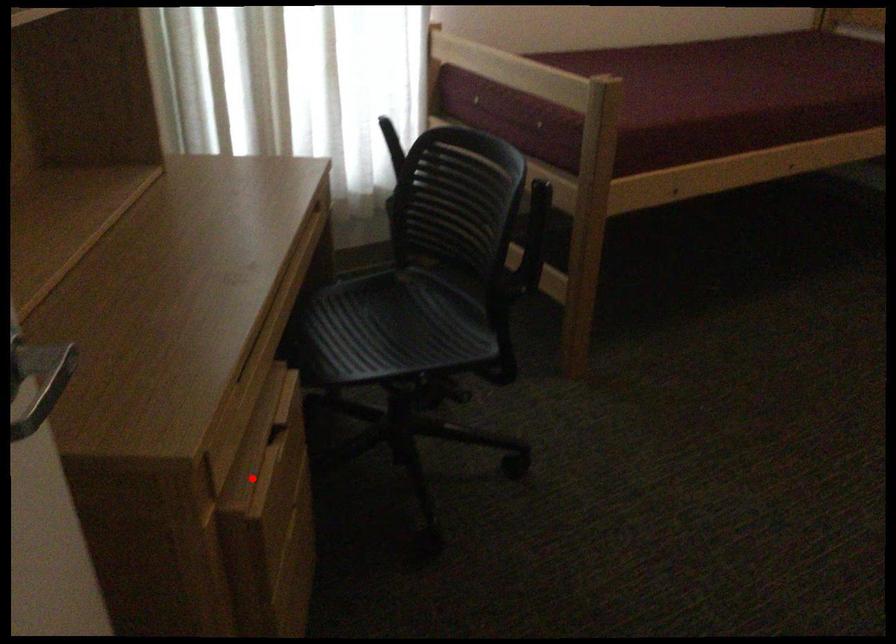
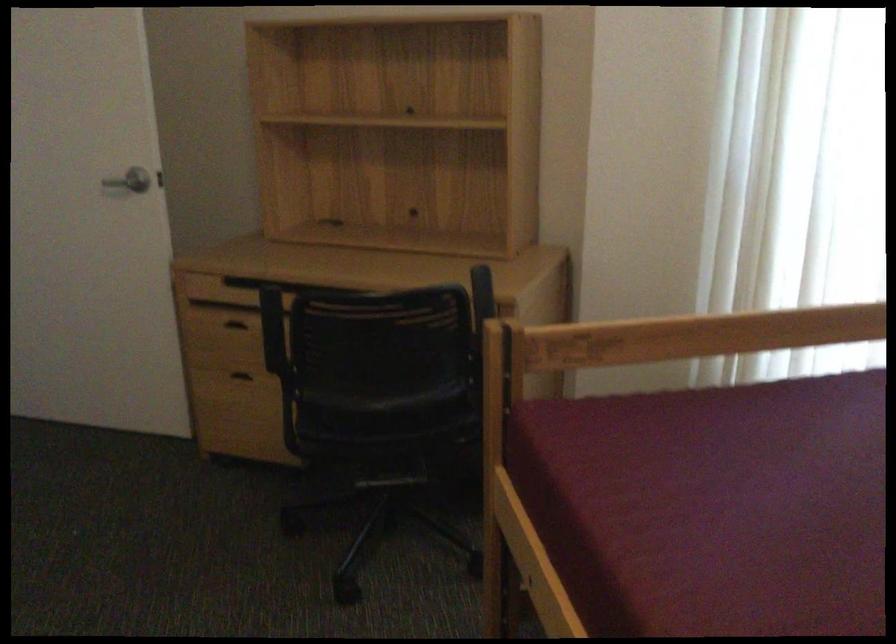
The point at the highlighted location is marked in the first image. Where is the corresponding point in the second image?

(240, 323)